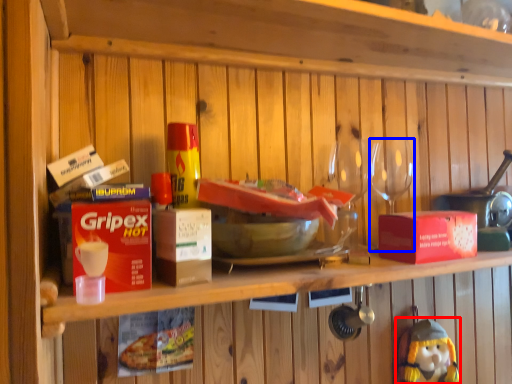
Question: Among these objects, which one is nearest to the camera, figurine (highlighted by a red box) or tableware (highlighted by a blue box)?

Choices:
 (A) figurine
 (B) tableware

Answer: (B)